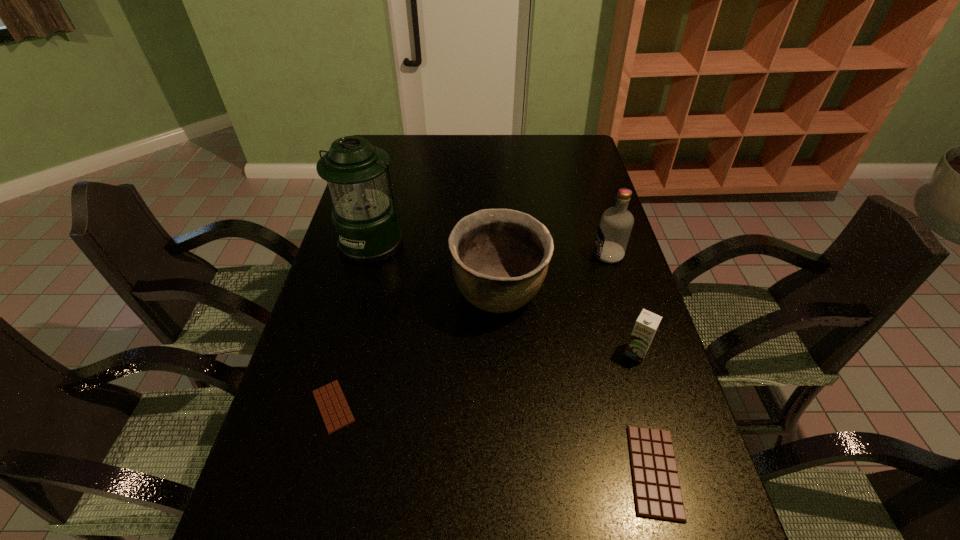
The width and height of the screenshot is (960, 540). I want to click on vacant space in between the vodka and the third object from left to right, so click(553, 274).

Image resolution: width=960 pixels, height=540 pixels. In order to click on free spot between the lantern and the left candy bar in this screenshot , I will do `click(353, 325)`.

Where is `vacant space that is in between the right candy bar and the left candy bar`? vacant space that is in between the right candy bar and the left candy bar is located at coordinates (493, 439).

Image resolution: width=960 pixels, height=540 pixels. Find the location of `vacant area that lies between the right candy bar and the left candy bar`. vacant area that lies between the right candy bar and the left candy bar is located at coordinates (493, 439).

In order to click on empty space that is in between the shorter candy bar and the fourth tallest object in this screenshot , I will do `click(485, 380)`.

Locate an element on the screen. The width and height of the screenshot is (960, 540). free space between the shorter candy bar and the chocolate milk is located at coordinates (485, 380).

At what (x,y) coordinates should I click in order to perform the action: click on free spot between the taller candy bar and the shortest object. Please return your answer as a coordinate pair (x, y). The image size is (960, 540). Looking at the image, I should click on (493, 439).

What are the coordinates of `free space between the right candy bar and the shorter candy bar` in the screenshot? It's located at (493, 439).

Choose which object is the nearest neighbor to the shorter candy bar. Please provide its 2D coordinates. Your answer should be formatted as a tuple, i.e. [(x, y)], where the tuple contains the x and y coordinates of a point satisfying the conditions above.

[(500, 257)]

Where is `object that ranks as the closest to the lantern`? This screenshot has height=540, width=960. object that ranks as the closest to the lantern is located at coordinates (500, 257).